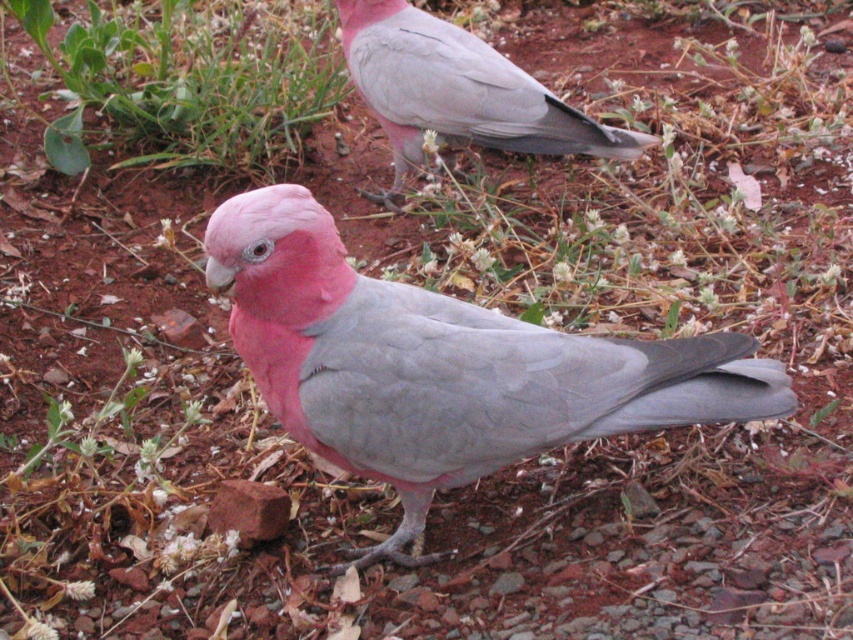
You are a photographer trying to capture a clear shot of the pink matte parrot at upper center. There is green leafy grass at upper left in the frame. Do you think the grass might block the view of the parrot?

The green leafy grass at upper left might be wider than pink matte parrot at upper center, so there is a possibility that the grass could block the view of the parrot.

You are a birdwatcher observing two galahs in the image. You notice a matte pink parrot at center and a pink matte parrot at upper center. Which of these two parrots is taller?

The matte pink parrot at center is taller than the pink matte parrot at upper center.